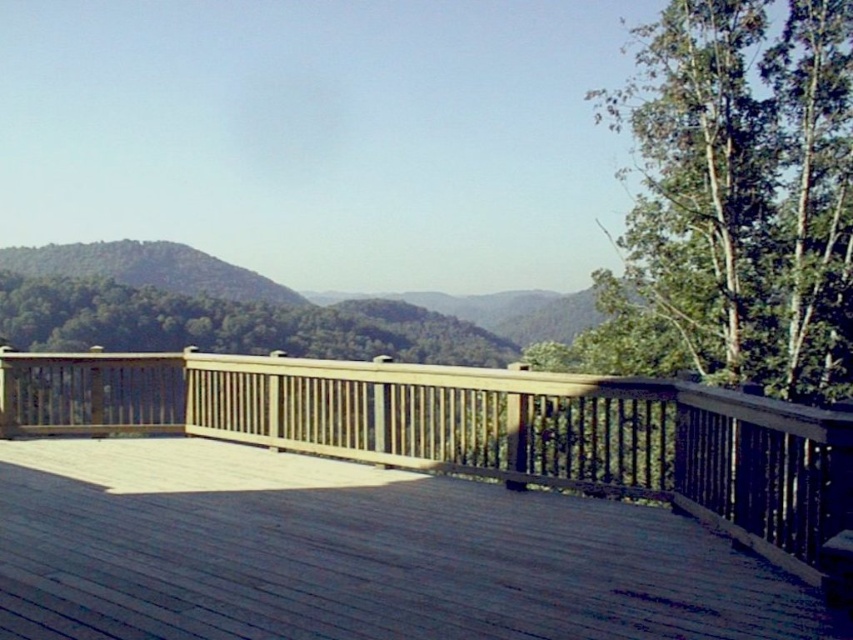
You are standing on the wooden deck at center and want to place a large picnic blanket. Considering the green leafy tree at upper right, which object has a greater width to accommodate the blanket?

The wooden deck at center has a greater width than the green leafy tree at upper right, so it can accommodate the picnic blanket better.

You are standing on the wooden deck at center and want to take a photo of the green leafy tree at upper right. Which direction should you face to capture the tree in the background?

You should face towards the upper right direction to capture the green leafy tree at upper right in the background since the wooden deck at center is in front of it.

You are standing on the wooden deck at center and want to look towards the green leafy tree at upper right. In which direction should you turn your head?

You should turn your head to the right because the wooden deck at center is positioned on the left side of the green leafy tree at upper right, meaning the tree is to your right side.